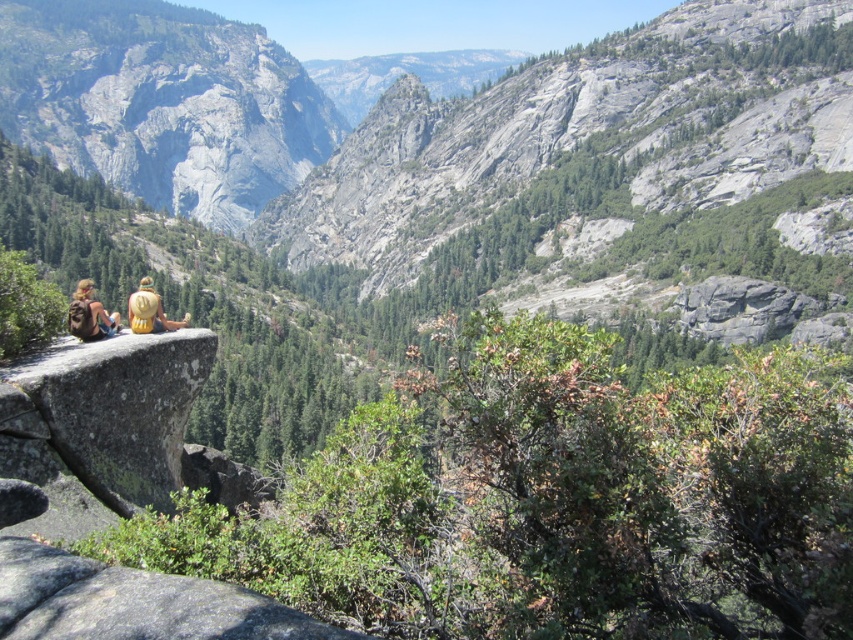
In the scene shown: Who is lower down, brown backpack at left or golden straw hat at center?

brown backpack at left is below.

Is the position of brown backpack at left more distant than that of golden straw hat at center?

No, brown backpack at left is in front of golden straw hat at center.

In the scene shown: Who is more forward, (83, 304) or (143, 326)?

Point (83, 304) is more forward.

Where is `brown backpack at left`? brown backpack at left is located at coordinates tap(88, 314).

Is matte yellow hat at center positioned in front of brown backpack at left?

Yes.

Does matte yellow hat at center come behind brown backpack at left?

No, matte yellow hat at center is in front of brown backpack at left.

The width and height of the screenshot is (853, 640). What are the coordinates of `matte yellow hat at center` in the screenshot? It's located at (90, 314).

Based on the photo, which is below, matte yellow hat at center or golden straw hat at center?

matte yellow hat at center is below.

Who is positioned more to the left, matte yellow hat at center or golden straw hat at center?

matte yellow hat at center

Between point (99, 310) and point (165, 321), which one is positioned behind?

Positioned behind is point (165, 321).

You are a GUI agent. You are given a task and a screenshot of the screen. Output one action in this format:
    pyautogui.click(x=<x>, y=<y>)
    Task: Click on the matte yellow hat at center
    The width and height of the screenshot is (853, 640).
    Given the screenshot: What is the action you would take?
    pyautogui.click(x=90, y=314)